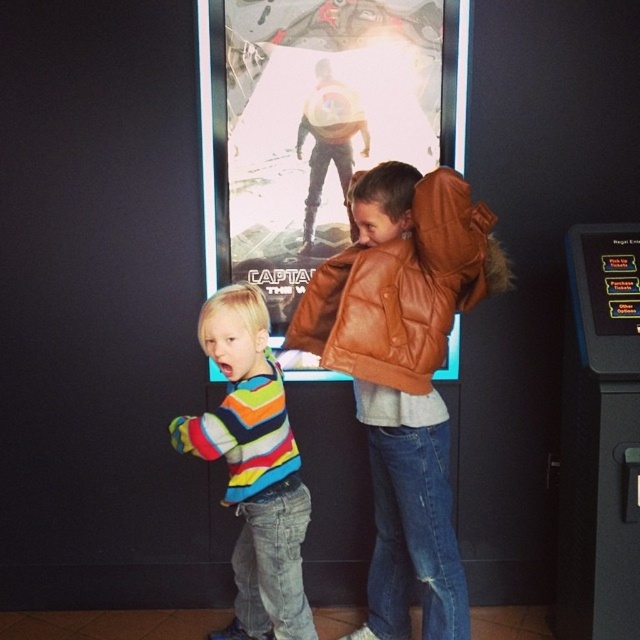
Is striped cotton shirt at center below shiny metallic suit at center?

Yes.

Can you confirm if striped cotton shirt at center is positioned above shiny metallic suit at center?

Incorrect, striped cotton shirt at center is not positioned above shiny metallic suit at center.

This screenshot has width=640, height=640. Find the location of `striped cotton shirt at center`. striped cotton shirt at center is located at coordinates (253, 467).

In the scene shown: Measure the distance between brown leather jacket at center and camera.

brown leather jacket at center and camera are 6.25 feet apart.

I want to click on brown leather jacket at center, so click(403, 291).

Between point (628, 445) and point (314, 305), which one is positioned in front?

Positioned in front is point (314, 305).

Is black plastic slot machine at right positioned at the back of brown leather jacket at center?

That is True.

Between point (573, 605) and point (387, 342), which one is positioned in front?

Positioned in front is point (387, 342).

Where is `black plastic slot machine at right`? The width and height of the screenshot is (640, 640). black plastic slot machine at right is located at coordinates (600, 436).